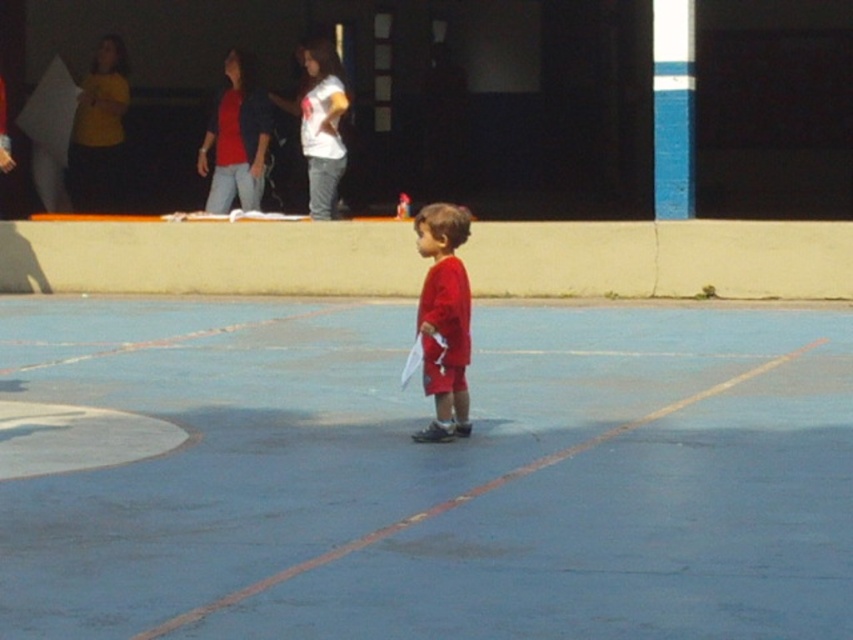
Who is more distant from viewer, (x=682, y=500) or (x=426, y=248)?

The point (x=426, y=248) is behind.

Is blue rubber basketball court at center above matte red shorts at center?

No.

Describe the element at coordinates (422, 474) in the screenshot. I see `blue rubber basketball court at center` at that location.

Where is `blue rubber basketball court at center`? The width and height of the screenshot is (853, 640). blue rubber basketball court at center is located at coordinates (422, 474).